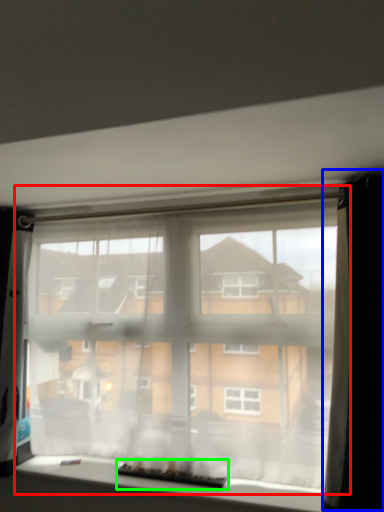
Question: Considering the real-world distances, which object is closest to window (highlighted by a red box)? curtain (highlighted by a blue box) or level (highlighted by a green box).

Choices:
 (A) curtain
 (B) level

Answer: (B)